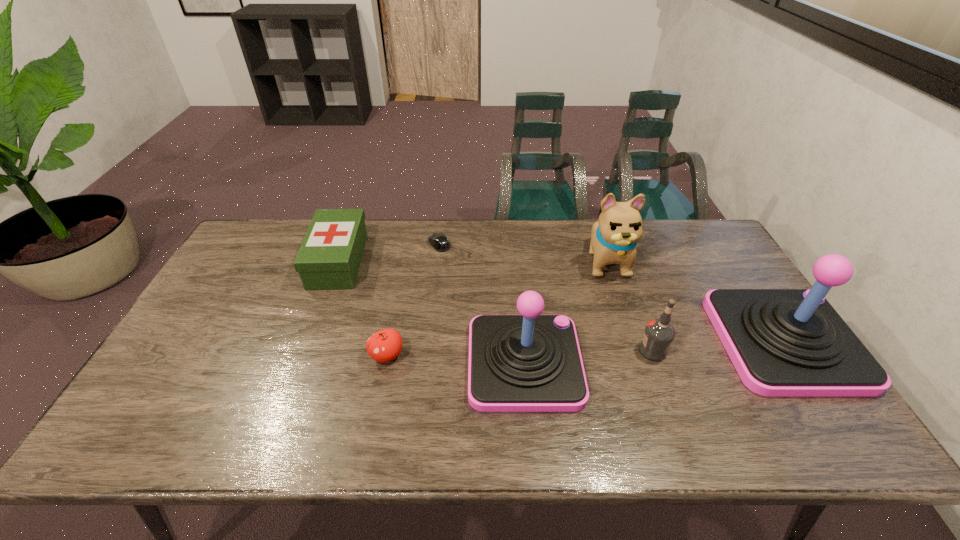
Find the location of a particular element. This screenshot has width=960, height=540. the sixth object from right to left is located at coordinates (385, 345).

Image resolution: width=960 pixels, height=540 pixels. In order to click on vodka in this screenshot , I will do `click(659, 333)`.

Where is `free location located forward from the base of the fourth object from left to right`? free location located forward from the base of the fourth object from left to right is located at coordinates (627, 362).

The width and height of the screenshot is (960, 540). What are the coordinates of `free space located on the right of the third shortest object` in the screenshot? It's located at (468, 261).

I want to click on vacant space located 0.330m on the right of the mouse, so click(x=547, y=245).

I want to click on blank space located on the face of the puppy, so click(x=633, y=340).

I want to click on blank area located on the front of the sixth tallest object, so click(378, 401).

This screenshot has height=540, width=960. Find the location of `free location located 0.130m on the front label of the fourth tallest object`. free location located 0.130m on the front label of the fourth tallest object is located at coordinates (589, 350).

Locate an element on the screen. This screenshot has height=540, width=960. vacant space located 0.120m on the front label of the fourth tallest object is located at coordinates (593, 350).

This screenshot has height=540, width=960. What are the coordinates of `free spot located 0.330m on the front label of the fourth tallest object` in the screenshot? It's located at (515, 350).